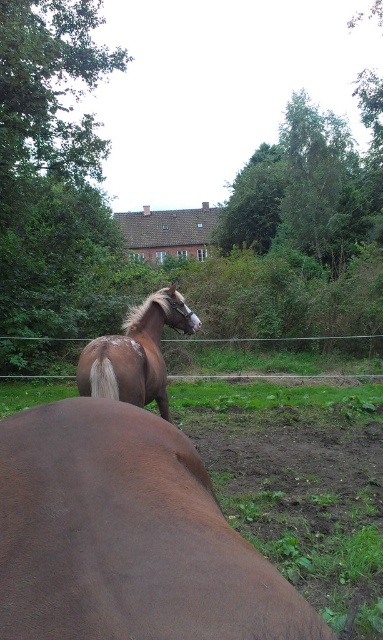
Question: Can you confirm if brown matte horse at center is positioned below brown glossy horse at center?

Choices:
 (A) yes
 (B) no

Answer: (A)

Question: Is green leafy tree at upper left to the left of green wire fence at center from the viewer's perspective?

Choices:
 (A) no
 (B) yes

Answer: (B)

Question: Which of the following is the closest to the observer?

Choices:
 (A) (16, 451)
 (B) (55, 337)

Answer: (A)

Question: Does brown matte horse at center have a smaller size compared to green leafy tree at upper left?

Choices:
 (A) yes
 (B) no

Answer: (A)

Question: Which of the following is the farthest from the observer?

Choices:
 (A) green wire fence at center
 (B) brown glossy horse at center
 (C) green leafy tree at upper left
 (D) brown matte horse at center

Answer: (C)

Question: Among these points, which one is farthest from the camera?

Choices:
 (A) (13, 196)
 (B) (199, 339)
 (C) (153, 538)

Answer: (B)